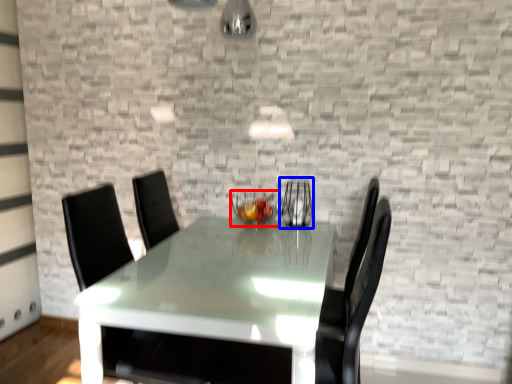
Question: Which object is further to the camera taking this photo, candle holder (highlighted by a red box) or glass vase (highlighted by a blue box)?

Choices:
 (A) candle holder
 (B) glass vase

Answer: (B)